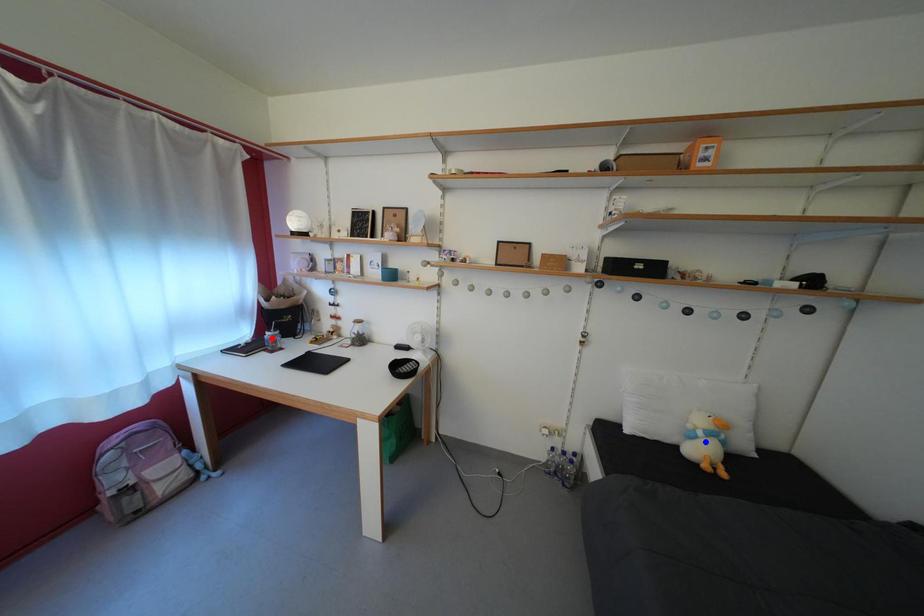
Question: Which of the two points in the image is closer to the camera?

Choices:
 (A) Blue point is closer.
 (B) Red point is closer.

Answer: (A)